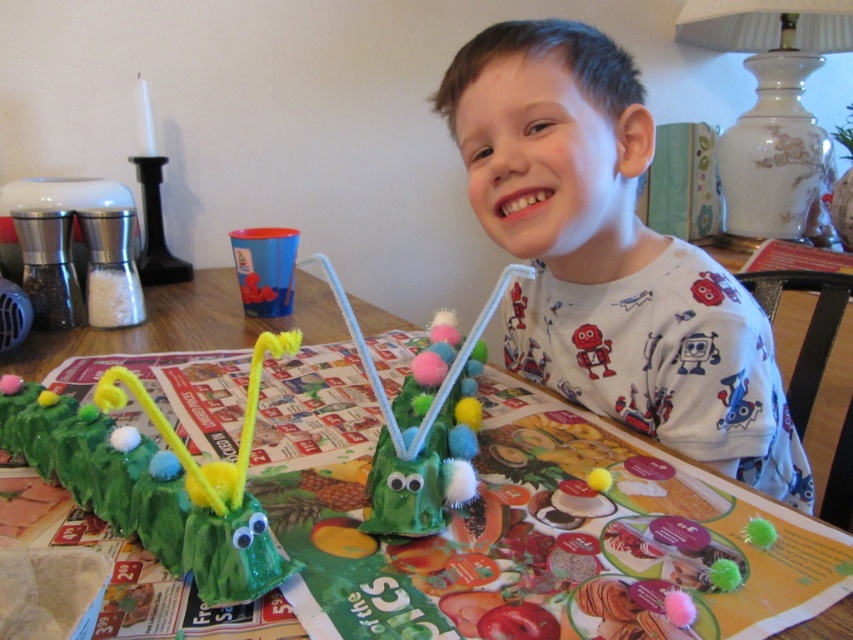
You are a photographer taking a picture of the white cotton shirt at upper center and the green fuzzy caterpillar at center. Which object should you focus on first if you want to capture both clearly in the same frame?

The white cotton shirt at upper center is located above the green fuzzy caterpillar at center, so you should focus on the white cotton shirt at upper center first to ensure both are in focus.

You are a visitor at the boy craft table. You see the green paper table at center and the green fuzzy caterpillar at center. Which object is closer to your left side?

The green paper table at center is to the left of the green fuzzy caterpillar at center, so the green paper table at center is closer to your left side.